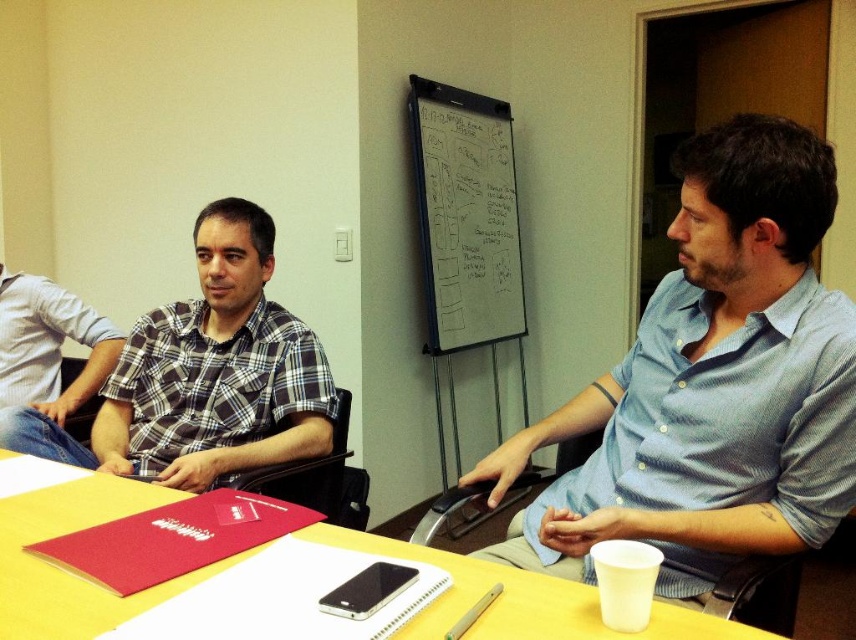
Question: Which of the following is the farthest from the observer?

Choices:
 (A) (507, 186)
 (B) (764, 378)
 (C) (87, 435)
 (D) (211, 477)

Answer: (A)

Question: Which is farther from the yellow matte table at center?

Choices:
 (A) whiteboard at upper center
 (B) matte plaid shirt at center
 (C) black leather chair at center

Answer: (A)

Question: Is whiteboard at upper center behind black leather chair at center?

Choices:
 (A) no
 (B) yes

Answer: (B)

Question: Considering the real-world distances, which object is closest to the plaid cotton shirt at center?

Choices:
 (A) blue striped shirt at center
 (B) matte plaid shirt at center
 (C) yellow matte table at center

Answer: (B)

Question: Considering the relative positions of yellow matte table at center and matte plaid shirt at center in the image provided, where is yellow matte table at center located with respect to matte plaid shirt at center?

Choices:
 (A) below
 (B) above

Answer: (A)

Question: In this image, where is plaid cotton shirt at center located relative to black leather chair at center?

Choices:
 (A) below
 (B) above

Answer: (B)